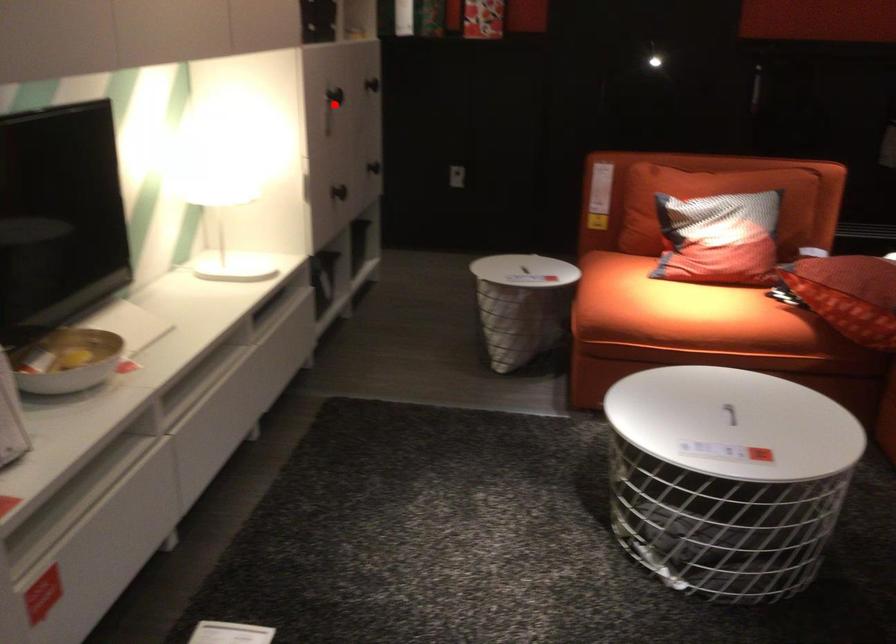
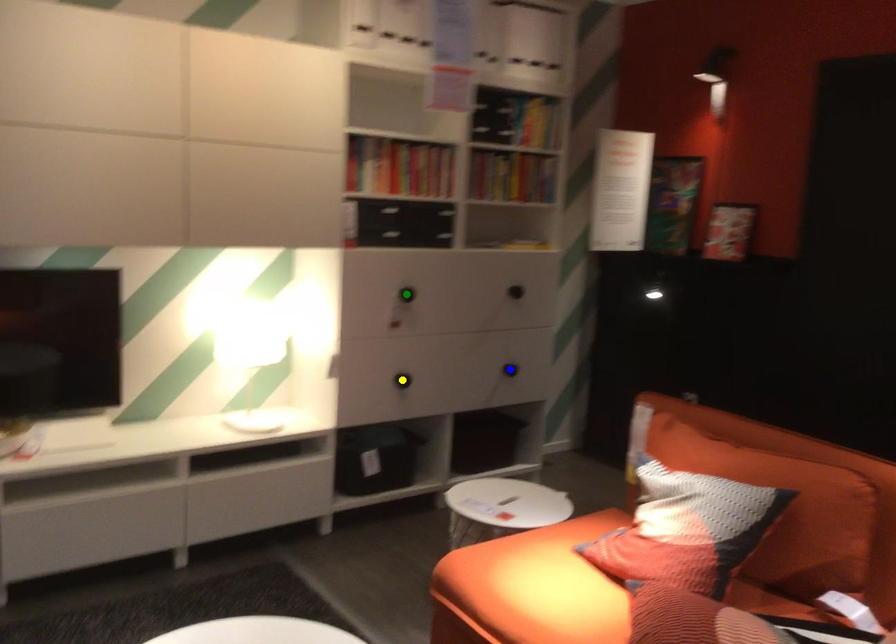
Question: I am providing you with two images of the same scene from different viewpoints. A red point is marked on the first image. You are given multiple points on the second image. Which mark in image 2 goes with the point in image 1?

Choices:
 (A) blue point
 (B) yellow point
 (C) green point

Answer: (C)